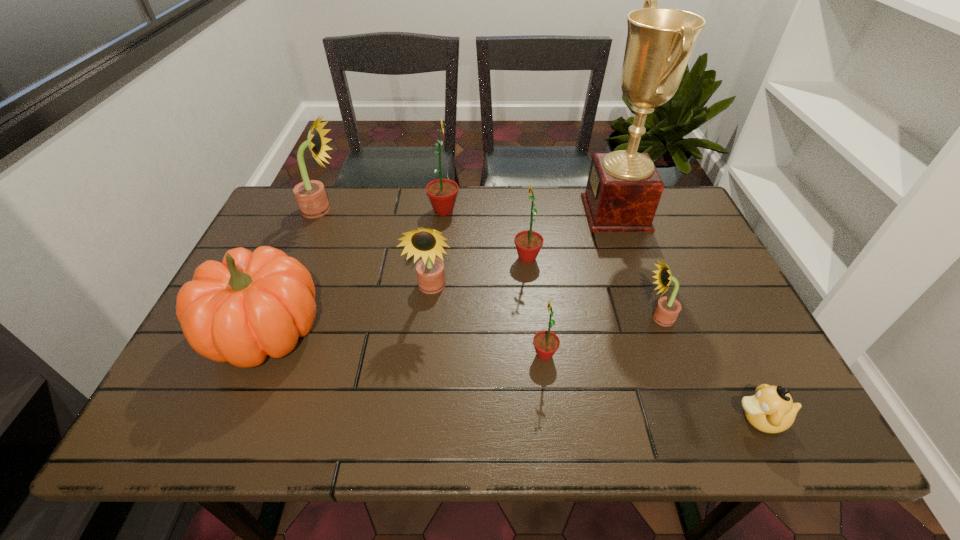
The height and width of the screenshot is (540, 960). Identify the location of free space located 0.210m on the face of the nearest sunflower. (438, 355).

Find the location of a particular element. The width and height of the screenshot is (960, 540). vacant space situated 0.210m on the face of the nearest sunflower is located at coordinates (438, 355).

Identify the location of vacant position located on the face of the shortest object. (692, 419).

The image size is (960, 540). In order to click on free space located 0.050m on the face of the shortest object in this screenshot , I will do `click(707, 419)`.

The height and width of the screenshot is (540, 960). I want to click on free region located on the face of the shortest object, so click(612, 419).

This screenshot has width=960, height=540. Find the location of `trophy cup that is at the far edge`. trophy cup that is at the far edge is located at coordinates (623, 190).

In order to click on object that is at the near edge in this screenshot , I will do `click(771, 410)`.

Locate an element on the screen. sunflower that is at the left edge is located at coordinates click(310, 195).

This screenshot has height=540, width=960. I want to click on pumpkin that is positioned at the left edge, so 251,305.

Where is `trophy cup that is at the right edge`? The image size is (960, 540). trophy cup that is at the right edge is located at coordinates (623, 190).